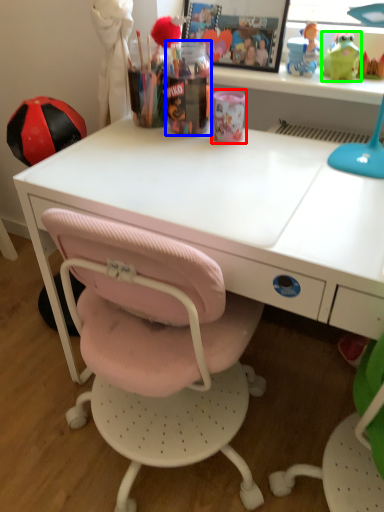
Question: Which object is the closest to the stationery (highlighted by a red box)? Choose among these: stationery (highlighted by a blue box) or toy (highlighted by a green box).

Choices:
 (A) stationery
 (B) toy

Answer: (A)